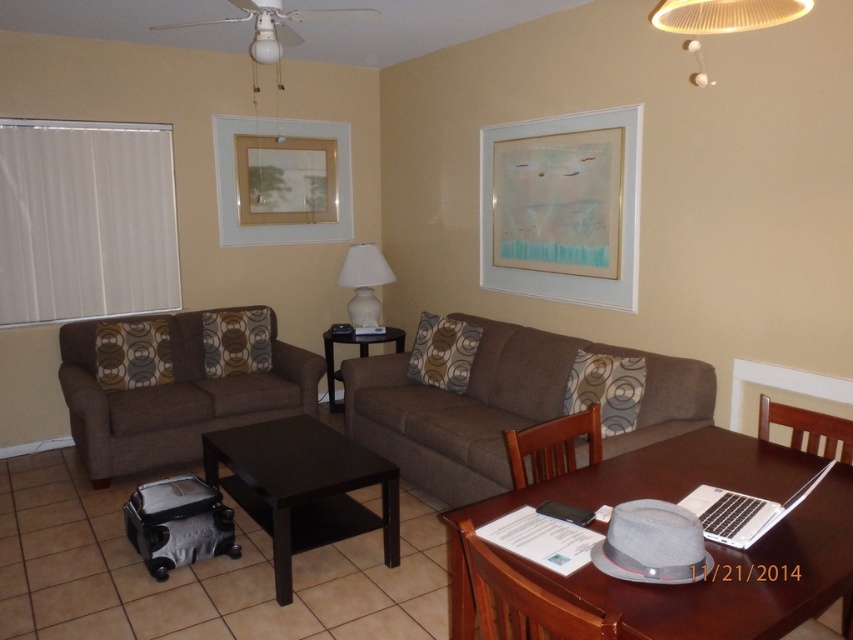
Can you confirm if white fabric lampshade at upper center is positioned below brown fabric chair at center?

Actually, white fabric lampshade at upper center is above brown fabric chair at center.

This screenshot has width=853, height=640. Describe the element at coordinates (721, 20) in the screenshot. I see `white fabric lampshade at upper center` at that location.

Which is in front, point (691, 77) or point (599, 433)?

Positioned in front is point (599, 433).

The width and height of the screenshot is (853, 640). Find the location of `white fabric lampshade at upper center`. white fabric lampshade at upper center is located at coordinates (721, 20).

Can you confirm if silver metallic laptop at lower right is taller than white glossy lamp at center?

Incorrect, silver metallic laptop at lower right's height is not larger of white glossy lamp at center's.

The height and width of the screenshot is (640, 853). What are the coordinates of `silver metallic laptop at lower right` in the screenshot? It's located at (741, 509).

Between point (709, 490) and point (364, 269), which one is positioned in front?

Point (709, 490) is more forward.

The height and width of the screenshot is (640, 853). In order to click on silver metallic laptop at lower right in this screenshot , I will do `click(741, 509)`.

Which is above, matte gold picture frame at upper center or brown fabric armchair at right?

matte gold picture frame at upper center

Image resolution: width=853 pixels, height=640 pixels. Describe the element at coordinates (281, 180) in the screenshot. I see `matte gold picture frame at upper center` at that location.

Which is behind, point (292, 211) or point (790, 406)?

The point (292, 211) is more distant.

Find the location of a particular element. The height and width of the screenshot is (640, 853). matte gold picture frame at upper center is located at coordinates click(x=281, y=180).